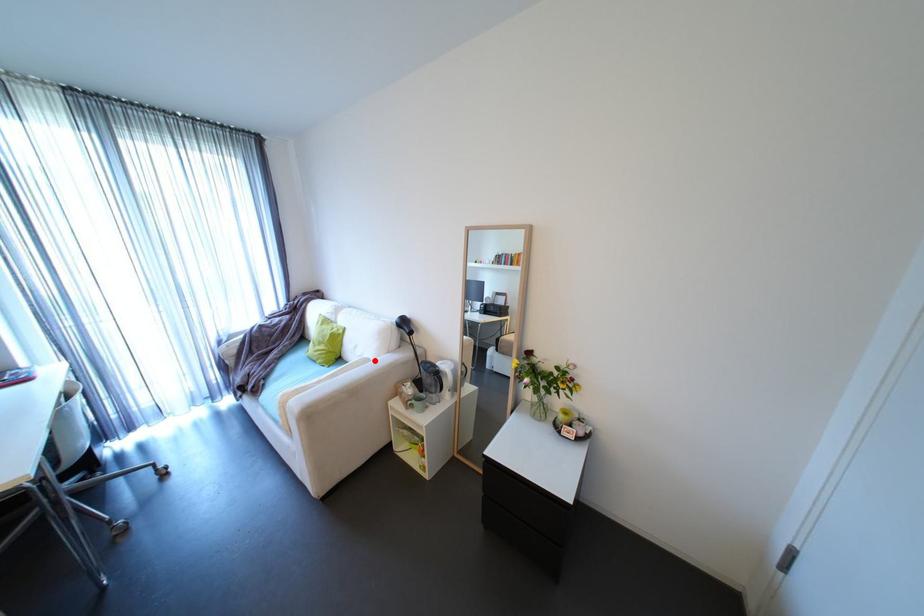
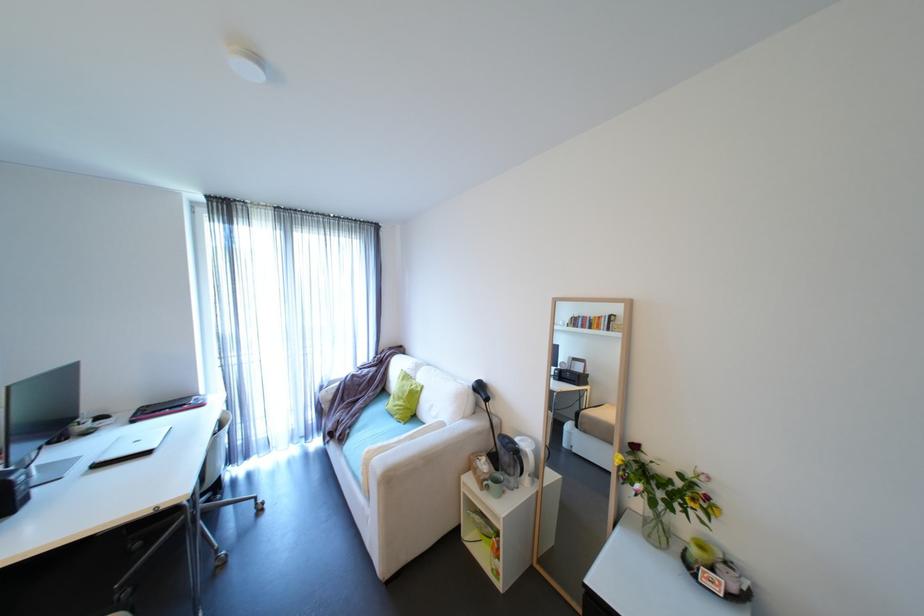
Where in the second image is the point corresponding to the highlighted location from the first image?

(450, 424)